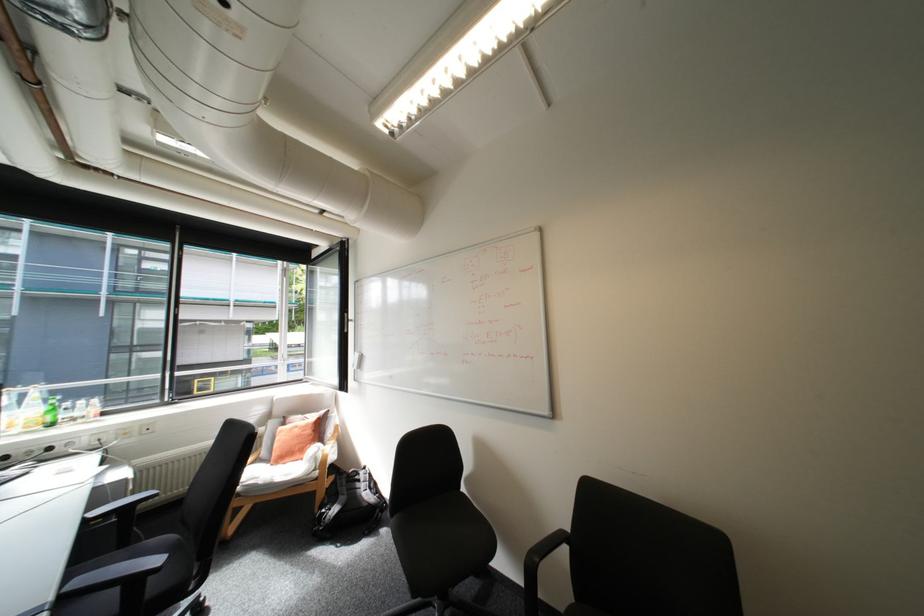
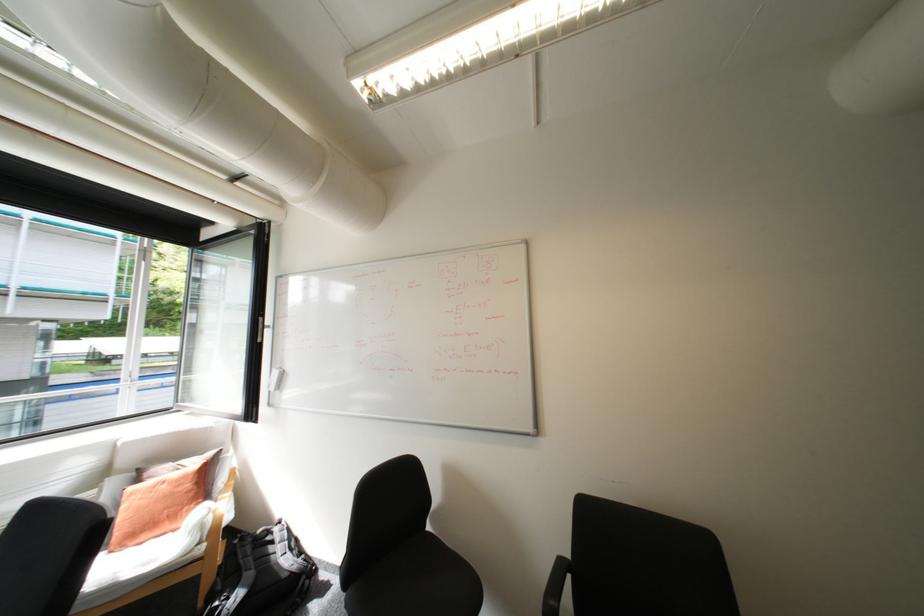
Locate, in the second image, the point that corresponds to (339,509) in the first image.

(238, 599)